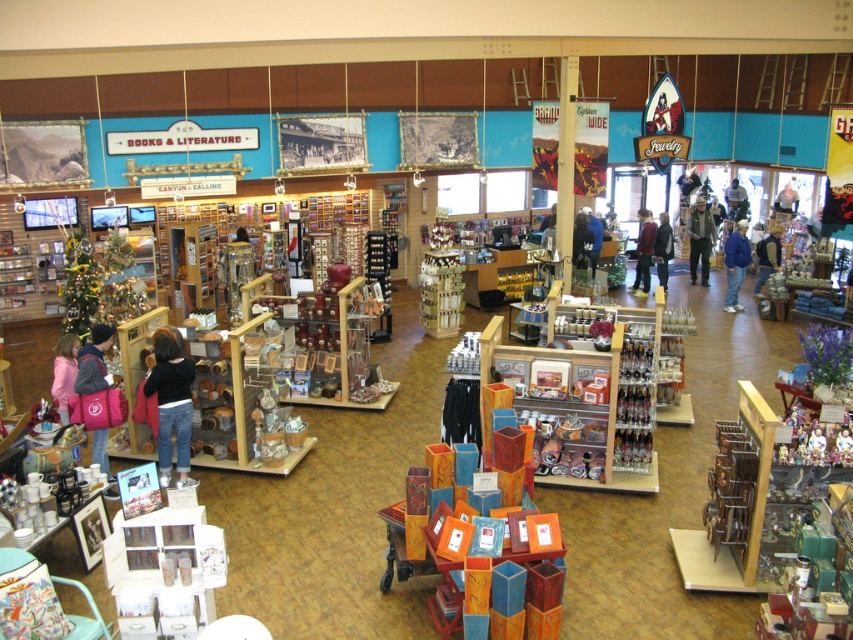
Question: Does dark blue sweater at center have a greater width compared to black leather jacket at center?

Choices:
 (A) yes
 (B) no

Answer: (A)

Question: Among these points, which one is farthest from the camera?

Choices:
 (A) 587,236
 (B) 689,236

Answer: (B)

Question: Estimate the real-world distances between objects in this image. Which object is closer to the khaki uniform pants at center?

Choices:
 (A) camouflage jacket at center
 (B) pink fabric bag at left

Answer: (A)

Question: Is jeans at center wider than dark blue sweater at center?

Choices:
 (A) yes
 (B) no

Answer: (A)

Question: Which point is farther from the camera taking this photo?

Choices:
 (A) (167, 424)
 (B) (685, 227)

Answer: (B)

Question: Is pink fabric bag at lower left closer to the viewer compared to blue denim jeans at center?

Choices:
 (A) yes
 (B) no

Answer: (A)